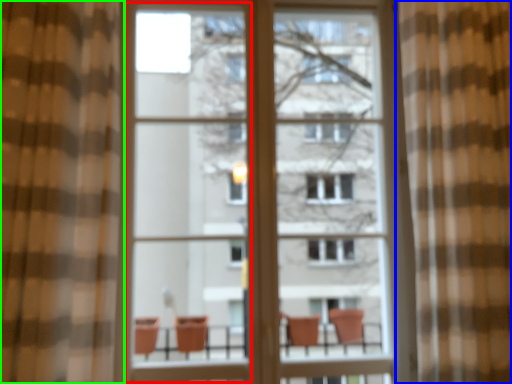
Question: Considering the real-world distances, which object is farthest from screen door (highlighted by a red box)? curtain (highlighted by a blue box) or curtain (highlighted by a green box)?

Choices:
 (A) curtain
 (B) curtain

Answer: (A)